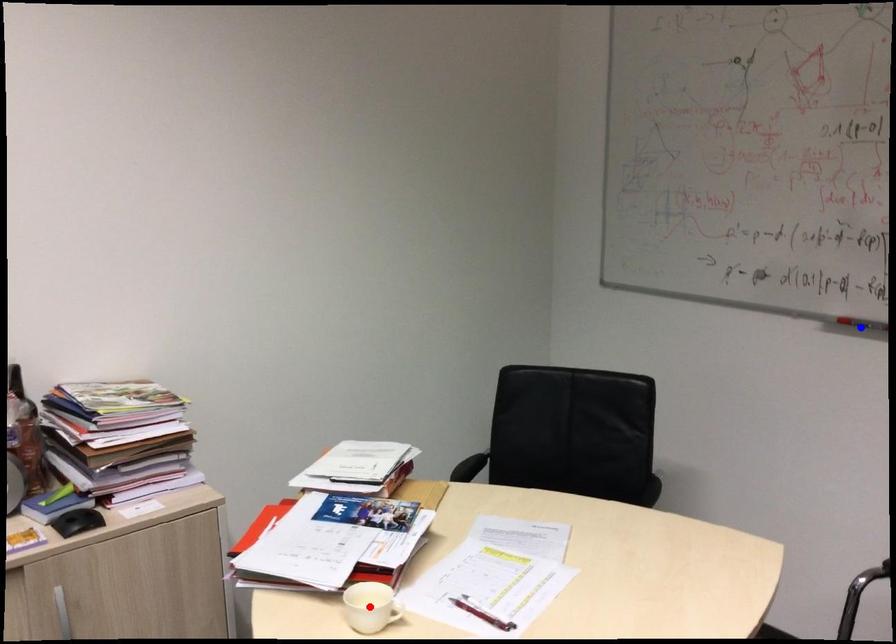
Question: Two points are marked on the image. Which point is closer to the camera?

Choices:
 (A) Blue point is closer.
 (B) Red point is closer.

Answer: (B)